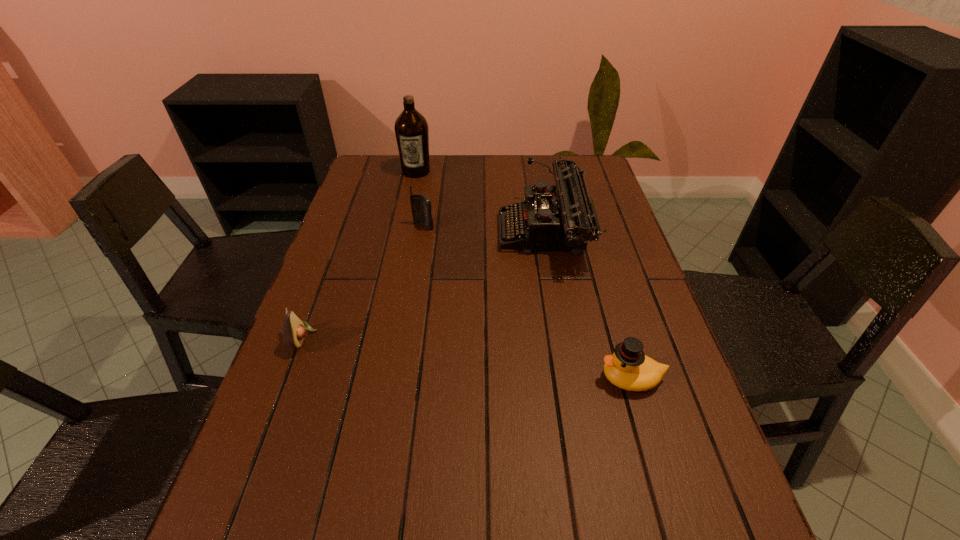
Identify the location of blank region between the nearest object and the typewriter. Image resolution: width=960 pixels, height=540 pixels. (588, 306).

This screenshot has height=540, width=960. I want to click on vacant space in between the avocado and the tallest object, so click(359, 255).

Where is `blank region between the nearest object and the typewriter`? This screenshot has width=960, height=540. blank region between the nearest object and the typewriter is located at coordinates coord(588,306).

I want to click on empty space that is in between the olive oil and the nearest object, so click(x=524, y=275).

Where is `object that is the third closest to the cellular telephone`? object that is the third closest to the cellular telephone is located at coordinates (294, 330).

Find the location of `object that is the second nearest to the cellular telephone`. object that is the second nearest to the cellular telephone is located at coordinates (411, 128).

Where is `blank space that satisfies the following two spatial constraints: 1. on the label of the tallest object; 2. on the seed side of the leftmost object`? This screenshot has height=540, width=960. blank space that satisfies the following two spatial constraints: 1. on the label of the tallest object; 2. on the seed side of the leftmost object is located at coordinates (381, 338).